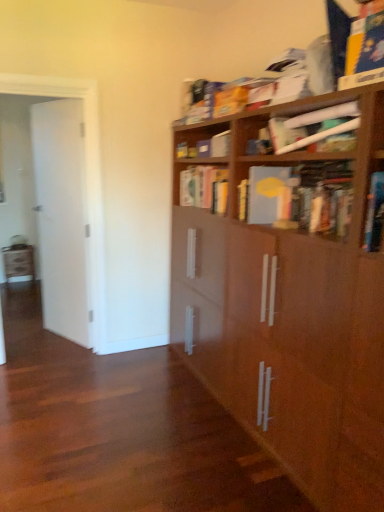
The width and height of the screenshot is (384, 512). What are the coordinates of `free space to the left of white glossy door at left` in the screenshot? It's located at (40, 333).